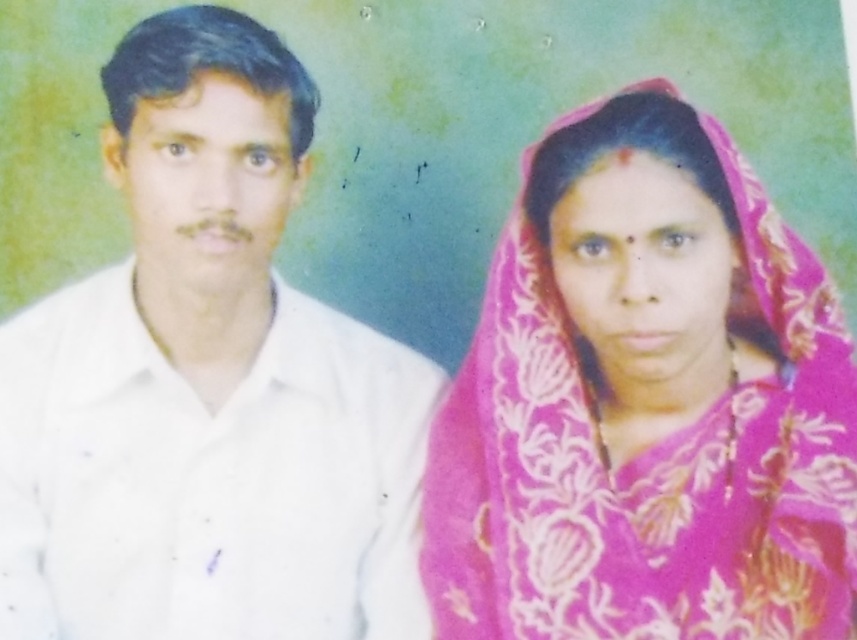
Measure the distance between white cotton shirt at left and pink floral fabric shawl at right.

They are 10.63 inches apart.

Between point (84, 584) and point (596, 516), which one is positioned behind?

The point (84, 584) is more distant.

Image resolution: width=857 pixels, height=640 pixels. What do you see at coordinates (207, 385) in the screenshot? I see `white cotton shirt at left` at bounding box center [207, 385].

I want to click on white cotton shirt at left, so click(x=207, y=385).